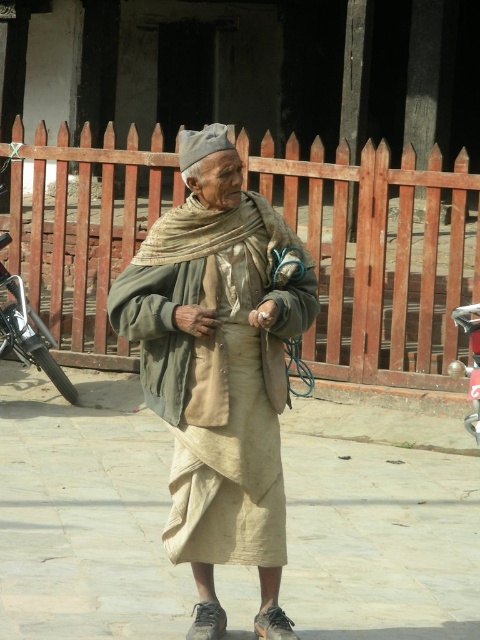
Question: Which point is farther from the camera taking this photo?

Choices:
 (A) (284, 508)
 (B) (383, 442)

Answer: (B)

Question: Can you confirm if beige fabric skirt at center is wider than beige fabric shawl at center?

Choices:
 (A) no
 (B) yes

Answer: (B)

Question: Which point is closer to the camera taking this photo?

Choices:
 (A) (210, 561)
 (B) (336, 433)

Answer: (A)

Question: Does beige fabric skirt at center have a greater width compared to beige fabric shawl at center?

Choices:
 (A) yes
 (B) no

Answer: (A)

Question: Does beige fabric skirt at center have a lesser width compared to beige fabric shawl at center?

Choices:
 (A) no
 (B) yes

Answer: (A)

Question: Which of the following is the closest to the observer?

Choices:
 (A) (159, 605)
 (B) (272, 344)

Answer: (B)